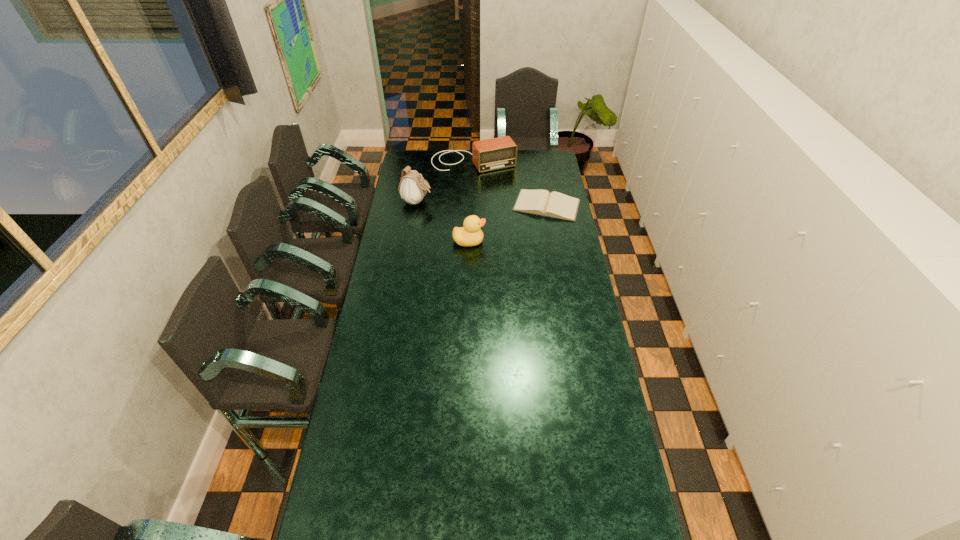
The width and height of the screenshot is (960, 540). Find the location of `vacant point located 0.350m on the front-facing side of the radio receiver`. vacant point located 0.350m on the front-facing side of the radio receiver is located at coordinates (510, 208).

Find the location of `vacant area situated 0.100m on the front-facing side of the radio receiver`. vacant area situated 0.100m on the front-facing side of the radio receiver is located at coordinates (493, 183).

Find the location of a particular element. The image size is (960, 540). object that is at the far edge is located at coordinates (497, 153).

Locate an element on the screen. This screenshot has width=960, height=540. object that is at the left edge is located at coordinates (412, 188).

You are a GUI agent. You are given a task and a screenshot of the screen. Output one action in this format:
    pyautogui.click(x=<x>, y=<y>)
    Task: Click on the object present at the right edge
    This screenshot has height=540, width=960.
    Given the screenshot: What is the action you would take?
    pyautogui.click(x=539, y=202)

This screenshot has width=960, height=540. I want to click on blank area at the far edge, so click(x=451, y=169).

You are a GUI agent. You are given a task and a screenshot of the screen. Output one action in this format:
    pyautogui.click(x=<x>, y=<y>)
    Task: Click on the blank area at the near edge
    
    Given the screenshot: What is the action you would take?
    pyautogui.click(x=442, y=522)

Identify the location of free space at the left edge of the desktop. (381, 327).

The width and height of the screenshot is (960, 540). In the image, there is a desktop. In order to click on vacant space at the right edge in this screenshot , I will do `click(576, 354)`.

Locate an element on the screen. free space at the far left corner of the desktop is located at coordinates (418, 171).